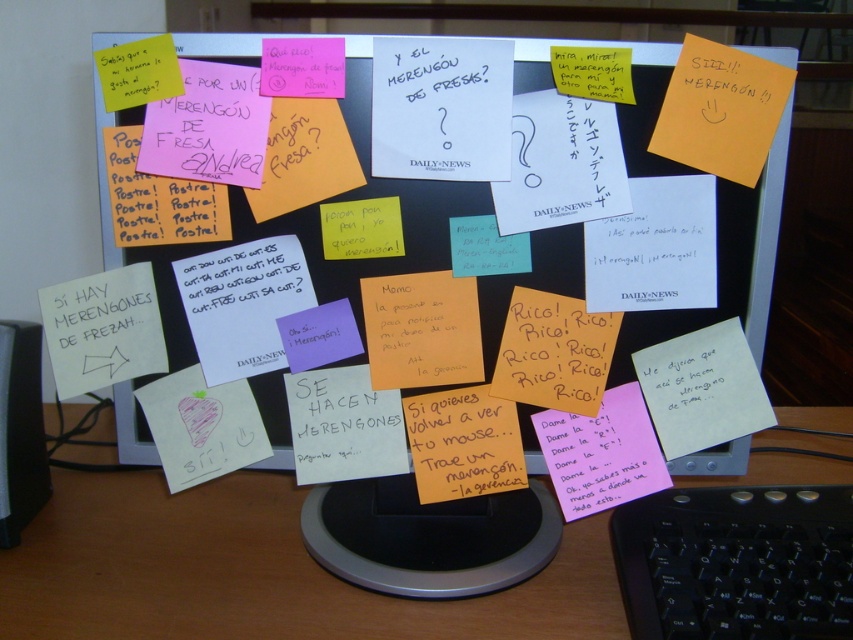
What is the exact coordinate of the white plastic table at center?

The white plastic table at center is located at point (254, 572).

You are organizing your workspace and need to move a water bottle from the white plastic table at center to the black plastic keyboard at lower right. Can you place it directly without moving the keyboard?

The white plastic table at center is located above the black plastic keyboard at lower right, so you can place the water bottle directly from the table to the keyboard without moving it.